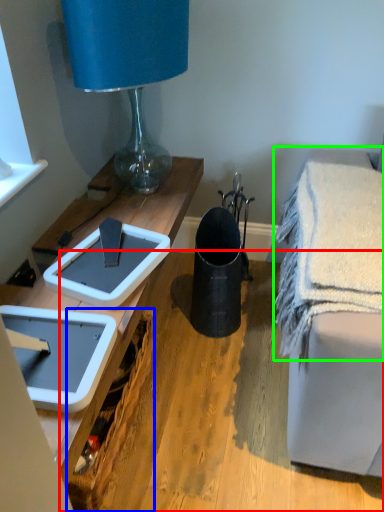
Question: Estimate the real-world distances between objects in this image. Which object is farther from wood (highlighted by a red box), picnic basket (highlighted by a blue box) or bath towel (highlighted by a green box)?

Choices:
 (A) picnic basket
 (B) bath towel

Answer: (B)